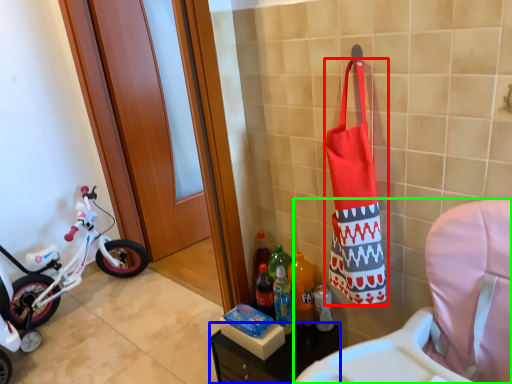
Question: Which object is the closest to the pouch (highlighted by a red box)? Choose among these: furniture (highlighted by a blue box) or rocking chair (highlighted by a green box).

Choices:
 (A) furniture
 (B) rocking chair

Answer: (B)